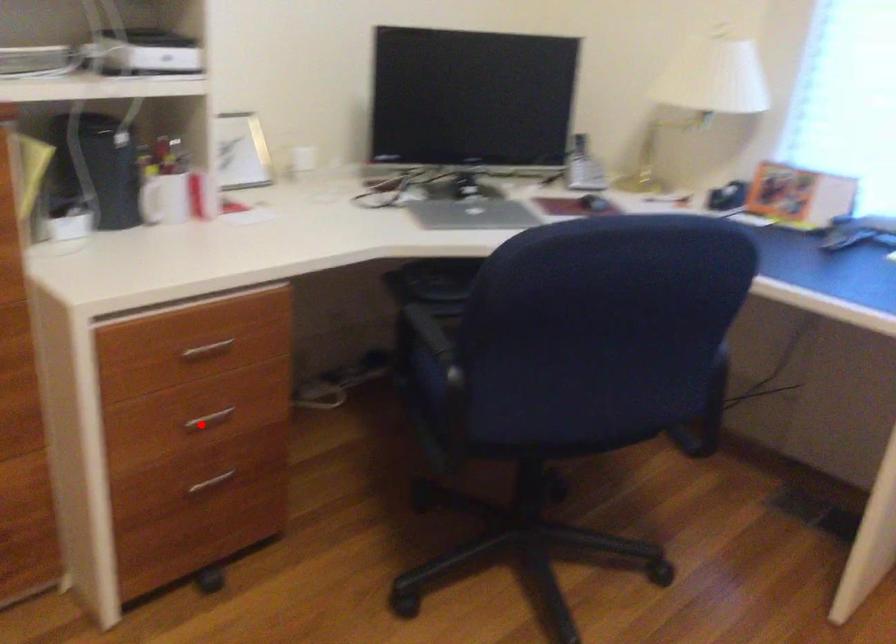
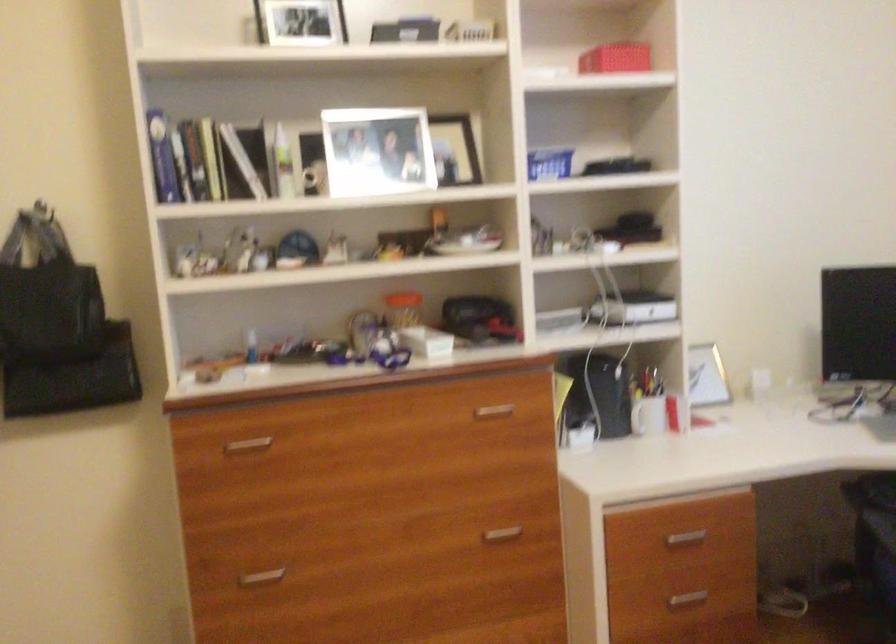
In the second image, find the point that corresponds to the highlighted location in the first image.

(686, 599)